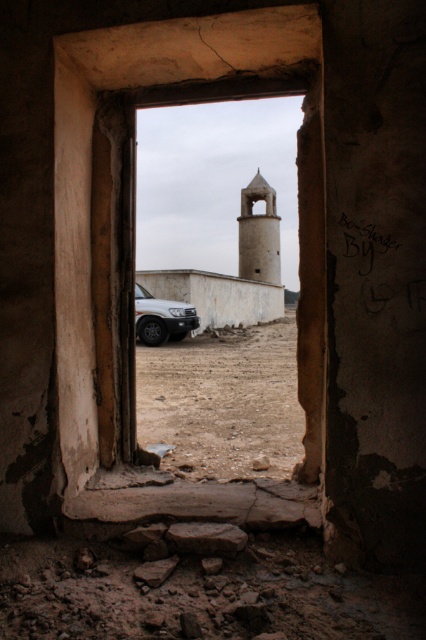
You are standing in the doorway and see the smooth beige tower at center and the sandy beige metallic car at center. Which object is positioned to the right when facing the doorway?

The smooth beige tower at center is to the right of the sandy beige metallic car at center when facing the doorway.

You are standing in front of the doorway and want to walk towards the sandy beige metallic car at center. Is the brown sandy dirt at center between you and the car?

Yes, the brown sandy dirt at center is between you and the sandy beige metallic car at center because it is closer to the viewer than the car.

You are standing outside the doorway and want to enter the outdoor area. The brown concrete window frame at center is blocking your path. Can you walk around it to reach the smooth beige tower at center?

The brown concrete window frame at center is positioned under the smooth beige tower at center, meaning the tower is above the window frame. Since the window frame is part of the doorway structure, you can walk around it through the doorway opening to reach the tower area.